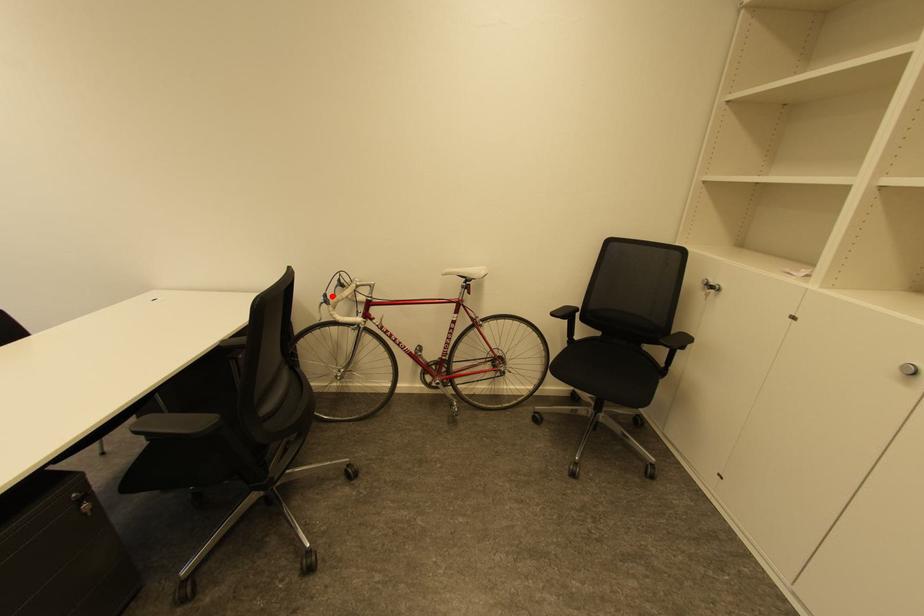
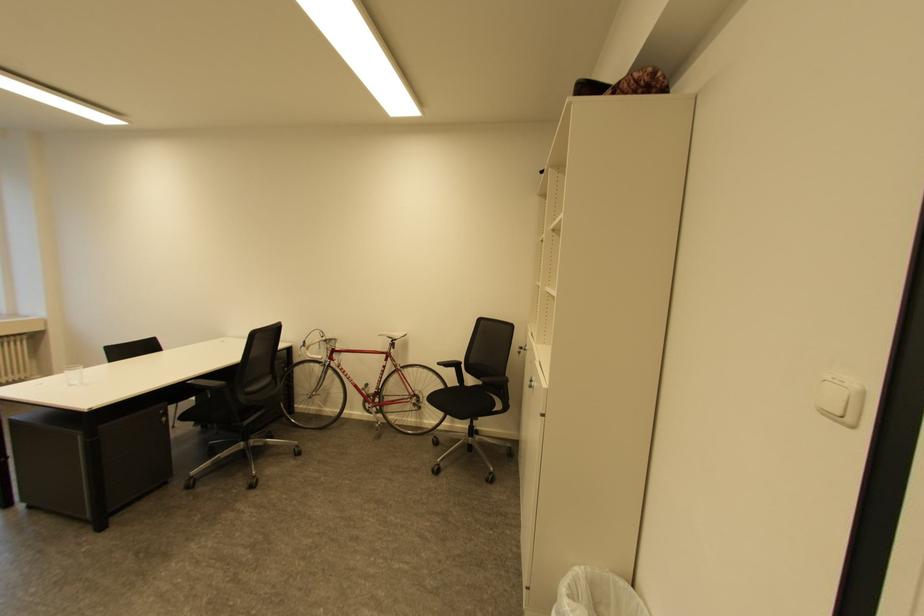
Find the pixel in the second image that matches the highlighted location in the first image.

(311, 342)